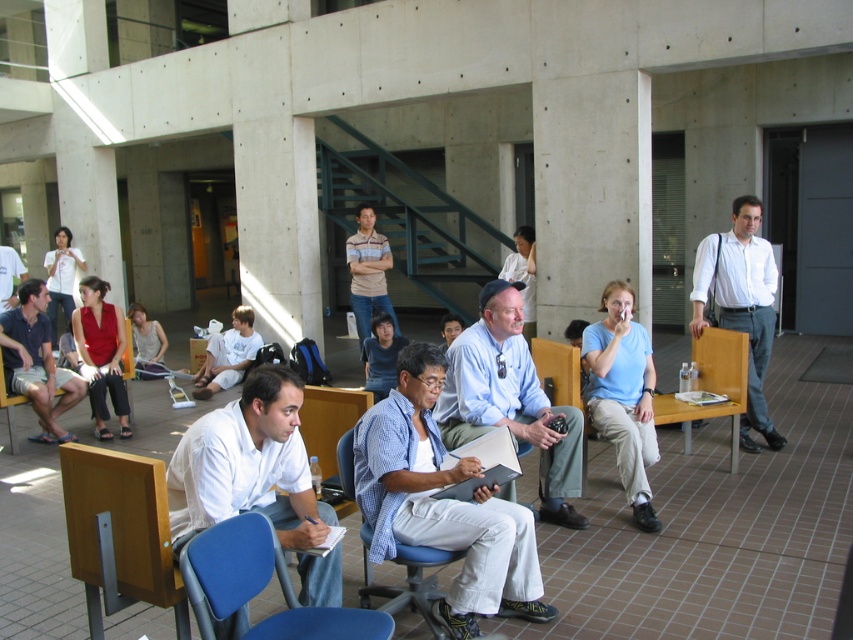
Question: Does white matte shirt at lower left have a larger size compared to light blue shirt at center?

Choices:
 (A) yes
 (B) no

Answer: (B)

Question: Considering the real-world distances, which object is closest to the white matte shirt at lower left?

Choices:
 (A) white shirt at right
 (B) light blue shirt at center

Answer: (B)

Question: Which of the following is the closest to the observer?

Choices:
 (A) checkered fabric shirt at center
 (B) white shirt at right

Answer: (A)

Question: Is matte blue shirt at left below blue fabric chair at center?

Choices:
 (A) yes
 (B) no

Answer: (B)

Question: Where is matte blue shirt at left located in relation to blue fabric chair at center in the image?

Choices:
 (A) right
 (B) left

Answer: (B)

Question: Estimate the real-world distances between objects in this image. Which object is closer to the white shirt at right?

Choices:
 (A) white matte shirt at lower left
 (B) matte blue shirt at left
 (C) blue fabric chair at center

Answer: (C)